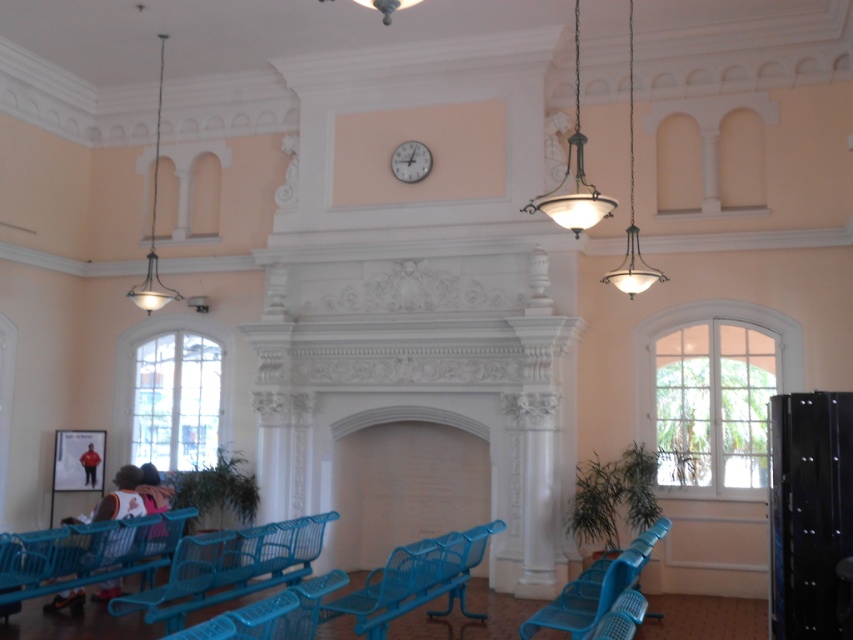
You are a visitor standing in the room and want to sit on the blue plastic bench at lower left. Can you comfortably sit there without bumping your head on the green glass pendant light at upper center?

The blue plastic bench at lower left is taller than the green glass pendant light at upper center, so sitting on the bench would not cause any head bumping since the bench itself is higher than the light.

You are sitting in the blue plastic chair at lower right and want to reach the metallic pendant light at upper left to adjust its brightness. Can you do this while staying seated?

The blue plastic chair at lower right is positioned under the metallic pendant light at upper left, but without information about the chair or light height, it is impossible to determine if you can reach it while seated.

You are standing in the room and want to sit on the blue plastic bench at lower left. Can you see the green glass pendant light at upper center from your seated position?

Yes, because the blue plastic bench at lower left is in front of the green glass pendant light at upper center, so when sitting on the bench, you should be able to see the pendant light located above and behind you.